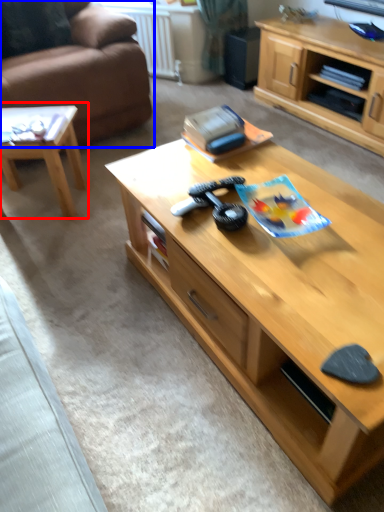
Question: Among these objects, which one is nearest to the camera, coffee table (highlighted by a red box) or studio couch (highlighted by a blue box)?

Choices:
 (A) coffee table
 (B) studio couch

Answer: (A)